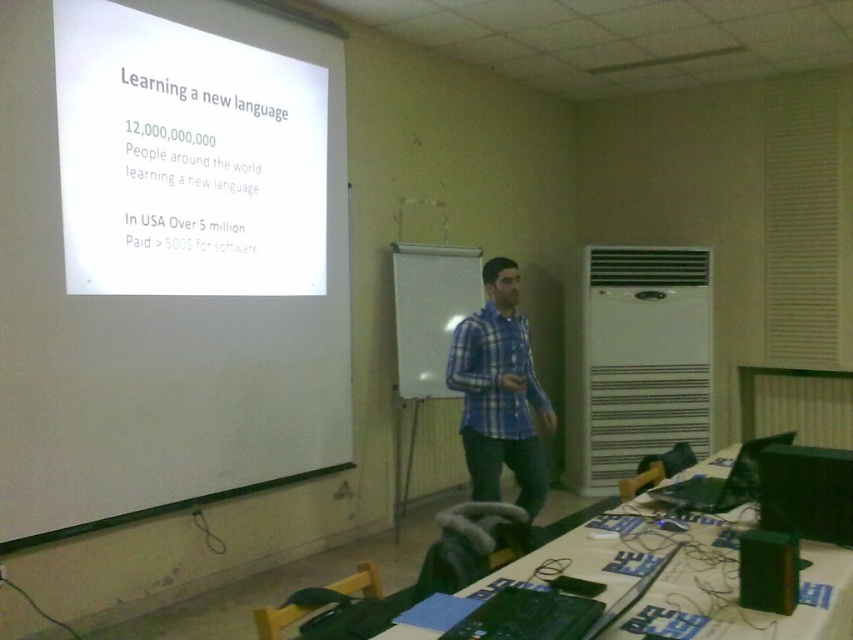
You are a student who needs to place a large textbook on the green fabric table at lower right and the whiteboard at center. Which surface can accommodate the textbook without it hanging over the edge?

The green fabric table at lower right has a larger width than the whiteboard at center, so the textbook can be placed on the green fabric table at lower right without hanging over the edge.

You are a student sitting at the green fabric table at lower right and you need to write something on the whiteboard at center. Can you easily reach it from your current position?

The green fabric table at lower right is in front of the whiteboard at center, so you are positioned in front of the whiteboard. To reach the whiteboard, you would need to move around the table or step behind it, which may be possible depending on the space available.

You are a student in the classroom and need to place a 7 inch wide dictionary on the green fabric table at lower right. Can the green matte book at lower right be placed next to the dictionary without overlapping?

The green fabric table at lower right and green matte book at lower right are 8.19 inches apart from each other. Since the dictionary is 7 inches wide, there is enough space between them to place the green matte book at lower right next to the dictionary without overlapping.